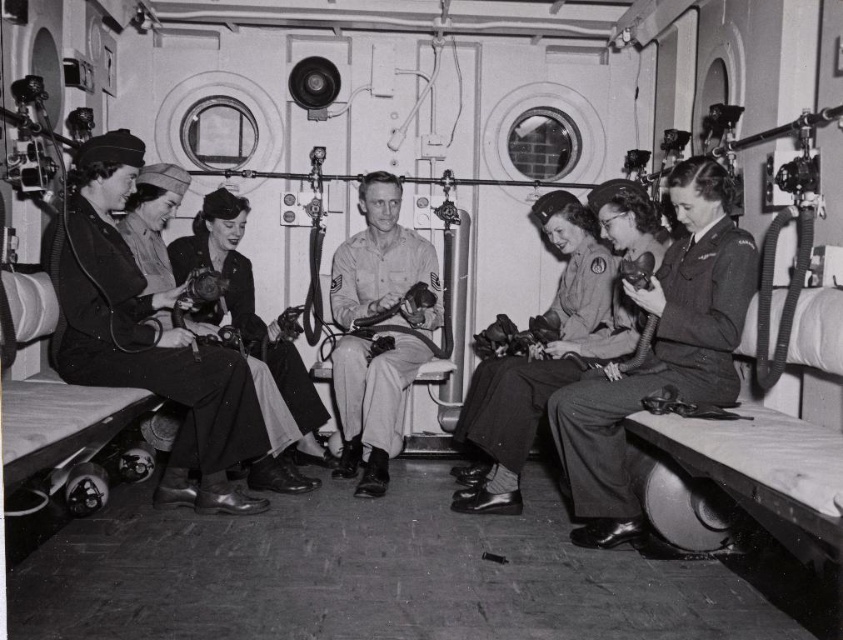
From the picture: You are a photographer standing at the front of the submarine. You need to take a photo of both the khaki uniform at center and the khaki cotton shirt at center. Can you fit both of them in your camera frame if your camera has a 20 inch wide field of view?

The distance between the khaki uniform at center and the khaki cotton shirt at center is 22.25 inches. Since the camera has a 20 inch wide field of view, which is narrower than the distance between them, you cannot fit both in the frame at the same time.

You are standing inside the submarine and need to locate the matte black uniform at center. Which direction should you look relative to the smooth leather shoes at left?

The matte black uniform at center is to the right of the smooth leather shoes at left, so you should look to the right of the smooth leather shoes at left to find it.

You are navigating a submarine and need to move from the point at coordinates point (701, 314) to the point at coordinates point (613, 269). Based on the scene description, which direction should you move in?

You should move backward because point (701, 314) is in front of point (613, 269), so moving backward will take you towards the latter point.